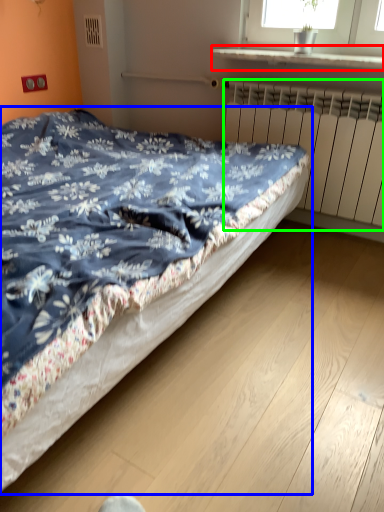
Question: Based on their relative distances, which object is nearer to window sill (highlighted by a red box)? Choose from bed (highlighted by a blue box) and radiator (highlighted by a green box).

Choices:
 (A) bed
 (B) radiator

Answer: (B)